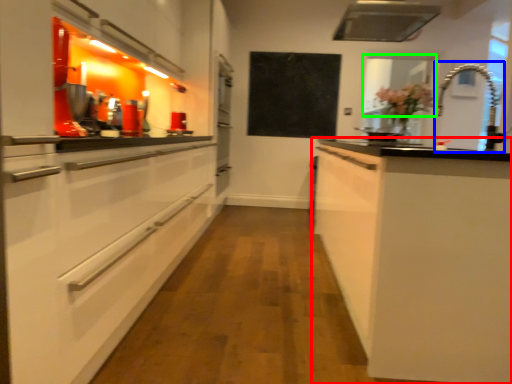
Question: Estimate the real-world distances between objects in this image. Which object is closer to cabinetry (highlighted by a red box), faucet (highlighted by a blue box) or window screen (highlighted by a green box)?

Choices:
 (A) faucet
 (B) window screen

Answer: (B)